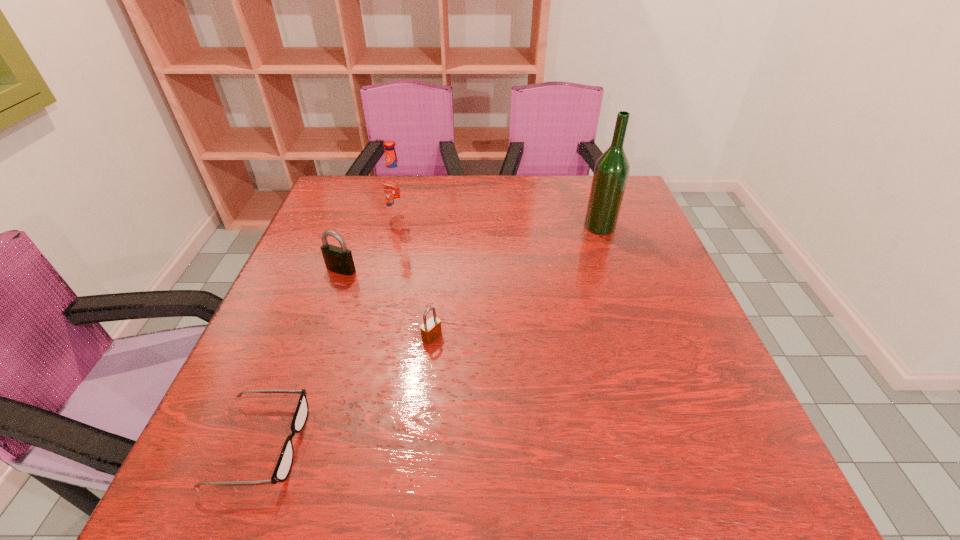
Locate an element on the screen. vacant space that satisfies the following two spatial constraints: 1. on the front side of the root beer; 2. on the right side of the alcohol is located at coordinates (397, 226).